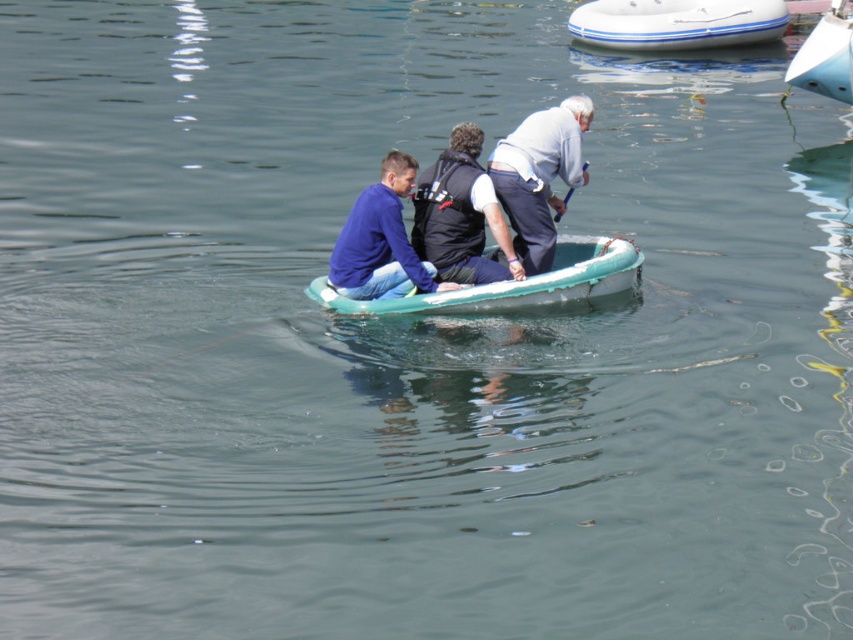
How distant is matte blue shirt at center from white glossy boat at upper right?

matte blue shirt at center is 36.43 feet away from white glossy boat at upper right.

Can you confirm if matte blue shirt at center is positioned to the right of white glossy boat at upper right?

In fact, matte blue shirt at center is to the left of white glossy boat at upper right.

You are a GUI agent. You are given a task and a screenshot of the screen. Output one action in this format:
    pyautogui.click(x=<x>, y=<y>)
    Task: Click on the matte blue shirt at center
    
    Given the screenshot: What is the action you would take?
    pyautogui.click(x=380, y=241)

At what (x,y) coordinates should I click in order to perform the action: click on matte blue shirt at center. Please return your answer as a coordinate pair (x, y). Looking at the image, I should click on (380, 241).

Can you confirm if white cotton shirt at upper center is bigger than white glossy boat at upper right?

Incorrect, white cotton shirt at upper center is not larger than white glossy boat at upper right.

Which is in front, point (532, 129) or point (840, 8)?

Point (532, 129) is more forward.

Locate an element on the screen. The image size is (853, 640). white cotton shirt at upper center is located at coordinates (538, 176).

Is black matte vest at center shorter than matte blue shirt at center?

Incorrect, black matte vest at center's height does not fall short of matte blue shirt at center's.

Between point (451, 218) and point (335, 262), which one is positioned in front?

Point (335, 262)

Which is in front, point (514, 275) or point (387, 182)?

Point (387, 182) is in front.

The width and height of the screenshot is (853, 640). In order to click on black matte vest at center in this screenshot , I will do `click(460, 214)`.